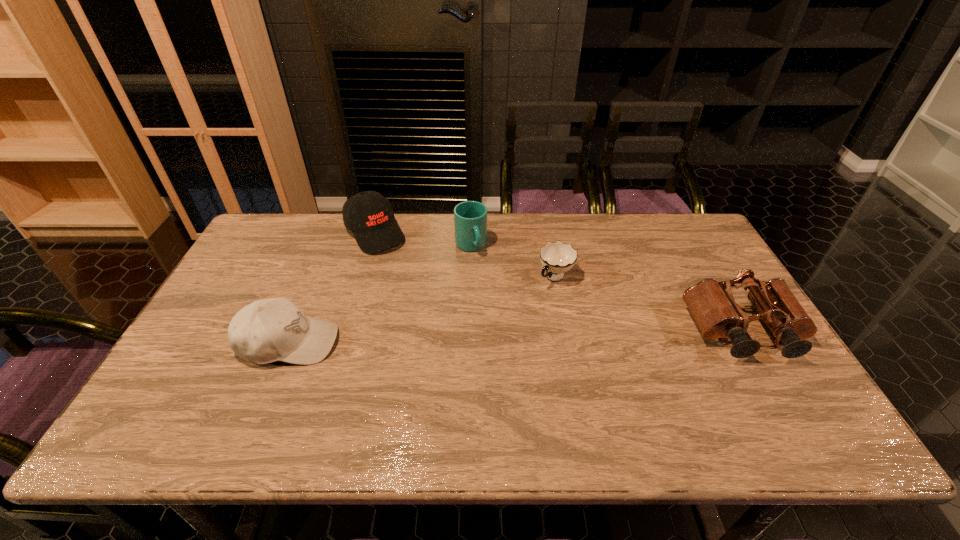
You are a GUI agent. You are given a task and a screenshot of the screen. Output one action in this format:
    pyautogui.click(x=<x>, y=<y>)
    Task: Click on the vacant space on the desktop that is between the nearer baseball cap and the rightmost object and is positioned on the side of the second object from right to left with the handle
    
    Given the screenshot: What is the action you would take?
    pyautogui.click(x=496, y=338)

I want to click on free spot on the desktop that is between the nearer baseball cap and the rightmost object and is positioned on the front-facing side of the farther baseball cap, so click(x=462, y=338).

This screenshot has width=960, height=540. In order to click on free space on the desktop that is between the nearer baseball cap and the rightmost object and is positioned on the handle side of the left cup in this screenshot , I will do `click(516, 337)`.